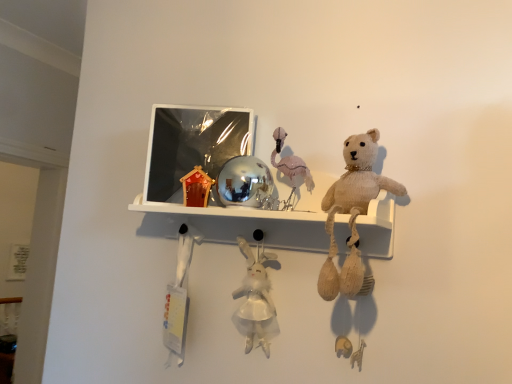
Question: Does white fabric toy at lower left, which is the 1th toy in left-to-right order, have a greater height compared to pink fabric flamingo at center, acting as the third toy starting from the left?

Choices:
 (A) no
 (B) yes

Answer: (B)

Question: Considering the relative sizes of white fabric toy at lower left, the third toy in the right-to-left sequence, and pink fabric flamingo at center, which is the 1th toy from right to left, in the image provided, is white fabric toy at lower left, the third toy in the right-to-left sequence, shorter than pink fabric flamingo at center, which is the 1th toy from right to left,?

Choices:
 (A) no
 (B) yes

Answer: (A)

Question: Is pink fabric flamingo at center, which is the 1th toy from right to left, at the back of white fabric toy at lower left, the third toy in the right-to-left sequence?

Choices:
 (A) yes
 (B) no

Answer: (B)

Question: Does white fabric toy at lower left, the third toy in the right-to-left sequence, lie behind pink fabric flamingo at center, which is the 1th toy from right to left?

Choices:
 (A) yes
 (B) no

Answer: (A)

Question: Is white fabric toy at lower left, which is the 1th toy in left-to-right order, to the left of pink fabric flamingo at center, acting as the third toy starting from the left, from the viewer's perspective?

Choices:
 (A) no
 (B) yes

Answer: (B)

Question: Is the surface of white fabric toy at lower left, the third toy in the right-to-left sequence, in direct contact with pink fabric flamingo at center, acting as the third toy starting from the left?

Choices:
 (A) no
 (B) yes

Answer: (A)

Question: Does pink fabric flamingo at center, acting as the third toy starting from the left, have a smaller size compared to white plush rabbit at center, which is the second toy in left-to-right order?

Choices:
 (A) no
 (B) yes

Answer: (B)

Question: From a real-world perspective, is pink fabric flamingo at center, acting as the third toy starting from the left, below white plush rabbit at center, marked as the second toy in a right-to-left arrangement?

Choices:
 (A) no
 (B) yes

Answer: (A)

Question: Is pink fabric flamingo at center, which is the 1th toy from right to left, at the right side of white plush rabbit at center, which is the second toy in left-to-right order?

Choices:
 (A) no
 (B) yes

Answer: (B)

Question: Is pink fabric flamingo at center, acting as the third toy starting from the left, at the left side of white plush rabbit at center, which is the second toy in left-to-right order?

Choices:
 (A) no
 (B) yes

Answer: (A)

Question: Can you confirm if pink fabric flamingo at center, which is the 1th toy from right to left, is shorter than white plush rabbit at center, which is the second toy in left-to-right order?

Choices:
 (A) no
 (B) yes

Answer: (B)

Question: From the image's perspective, would you say pink fabric flamingo at center, which is the 1th toy from right to left, is shown under white plush rabbit at center, which is the second toy in left-to-right order?

Choices:
 (A) no
 (B) yes

Answer: (A)

Question: From the image's perspective, would you say white fabric toy at lower left, which is the 1th toy in left-to-right order, is positioned over white plush rabbit at center, which is the second toy in left-to-right order?

Choices:
 (A) yes
 (B) no

Answer: (B)